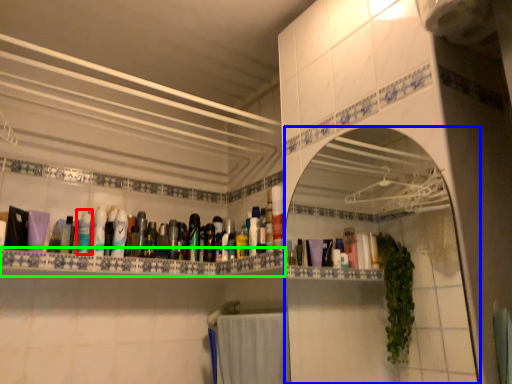
Question: Which object is positioned closest to mouthwash (highlighted by a red box)? Select from mirror (highlighted by a blue box) and ledge (highlighted by a green box).

Choices:
 (A) mirror
 (B) ledge

Answer: (B)